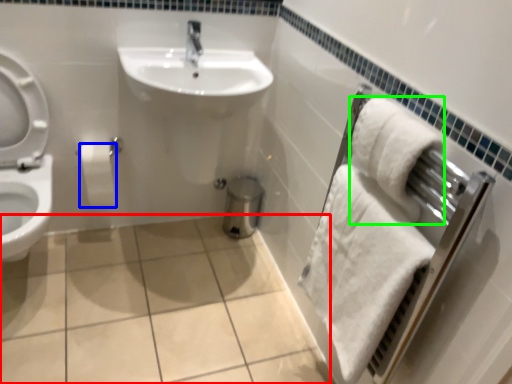
Question: Which object is the closest to the ceramic tile (highlighted by a red box)? Choose among these: toilet paper (highlighted by a blue box) or bath towel (highlighted by a green box).

Choices:
 (A) toilet paper
 (B) bath towel

Answer: (A)